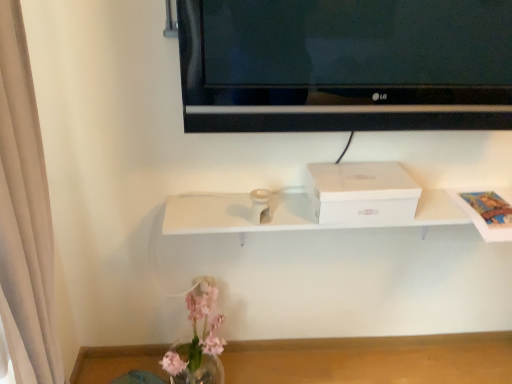
Where is `empty space that is ontop of transparent glass vase at lower center (from a real-world perspective)`? This screenshot has width=512, height=384. empty space that is ontop of transparent glass vase at lower center (from a real-world perspective) is located at coordinates (317, 357).